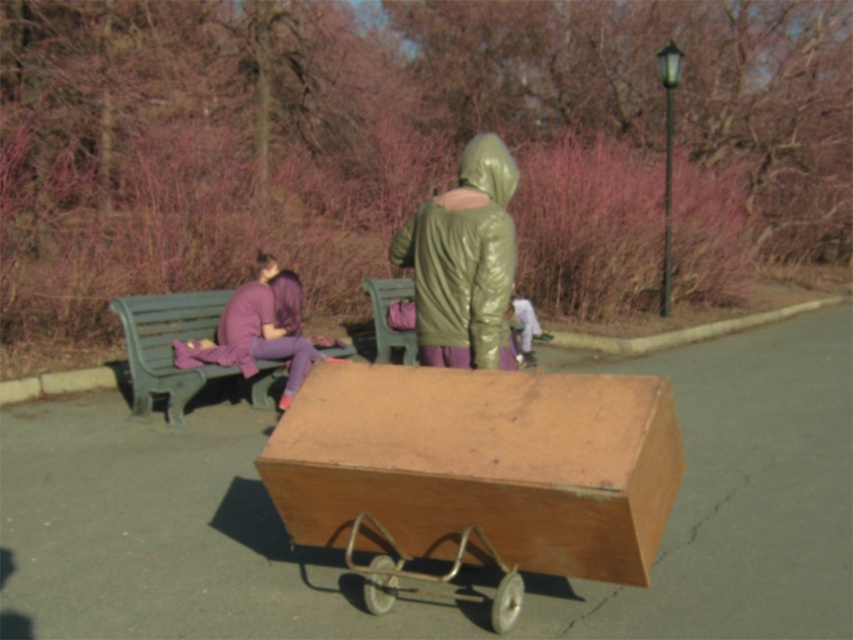
Which is in front, point (471, 202) or point (166, 385)?

Point (471, 202) is in front.

Who is lower down, green shiny jacket at center or green plastic bench at left?

Positioned lower is green plastic bench at left.

Between point (456, 292) and point (207, 321), which one is positioned in front?

Positioned in front is point (456, 292).

You are a GUI agent. You are given a task and a screenshot of the screen. Output one action in this format:
    pyautogui.click(x=<x>, y=<y>)
    Task: Click on the green shiny jacket at center
    
    Given the screenshot: What is the action you would take?
    pyautogui.click(x=463, y=260)